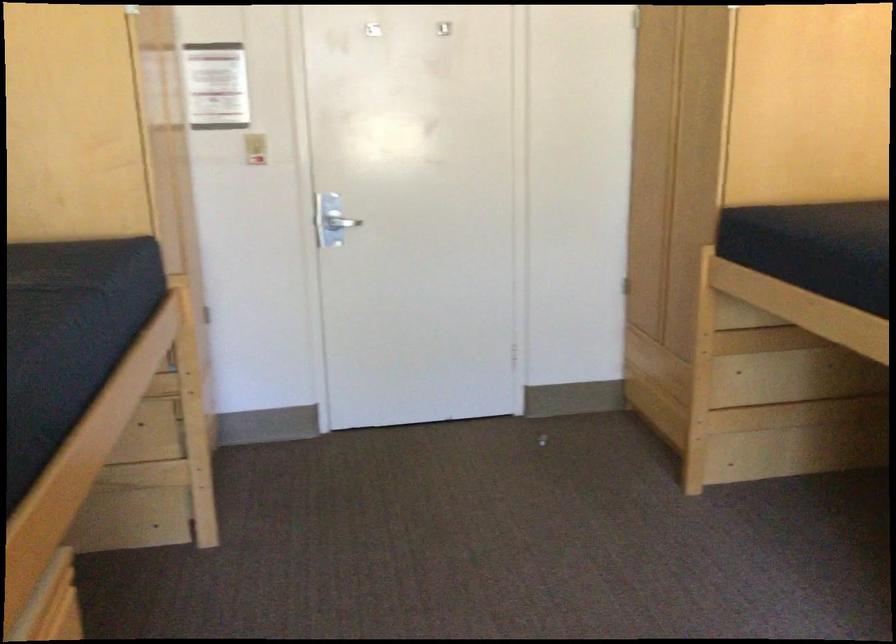
Image resolution: width=896 pixels, height=644 pixels. Describe the element at coordinates (332, 222) in the screenshot. I see `the silver door handle` at that location.